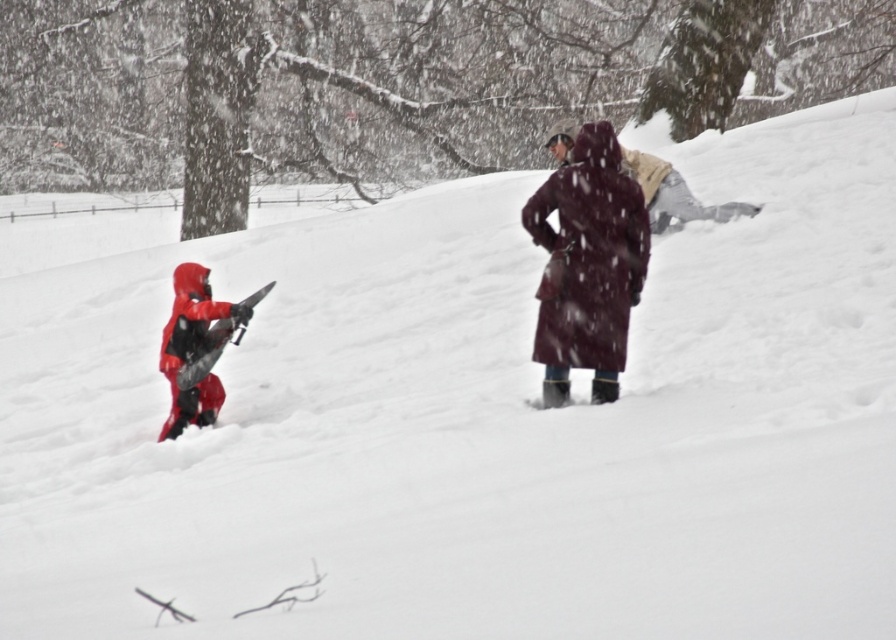
Is velvet maroon coat at center shorter than matte red snowsuit at left?

In fact, velvet maroon coat at center may be taller than matte red snowsuit at left.

Does velvet maroon coat at center appear on the right side of matte red snowsuit at left?

Indeed, velvet maroon coat at center is positioned on the right side of matte red snowsuit at left.

Who is more forward, (627, 252) or (190, 268)?

Point (627, 252) is in front.

Identify the location of velvet maroon coat at center. (587, 264).